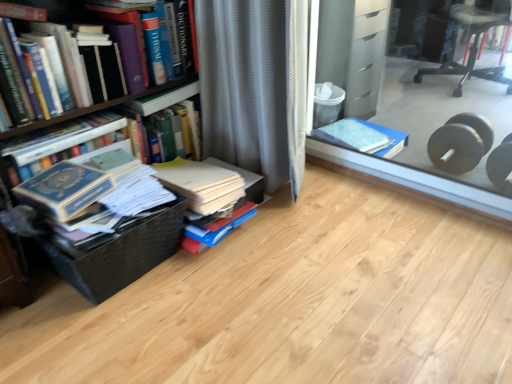
Question: Looking at the image, does blue cardboard box at center seem bigger or smaller compared to gray textured curtain at center?

Choices:
 (A) small
 (B) big

Answer: (B)

Question: From their relative heights in the image, would you say blue cardboard box at center is taller or shorter than gray textured curtain at center?

Choices:
 (A) short
 (B) tall

Answer: (A)

Question: Estimate the real-world distances between objects in this image. Which object is farther from the gray textured curtain at center?

Choices:
 (A) white paper at center, marked as the second book in a right-to-left arrangement
 (B) black plastic chair at upper right
 (C) black woven basket at lower left
 (D) hardcover book at left, arranged as the 2th book when viewed from the left
 (E) blue matte book at upper right, the 4th book viewed from the left

Answer: (B)

Question: Estimate the real-world distances between objects in this image. Which object is farther from the hardcover book at left, arranged as the 1th book when viewed from the left?

Choices:
 (A) blue cardboard box at center
 (B) hardcover book at left, arranged as the 2th book when viewed from the left
 (C) black woven basket at lower left
 (D) blue matte book at upper right, the 4th book viewed from the left
 (E) white paper at center, which is the third book from left to right

Answer: (A)